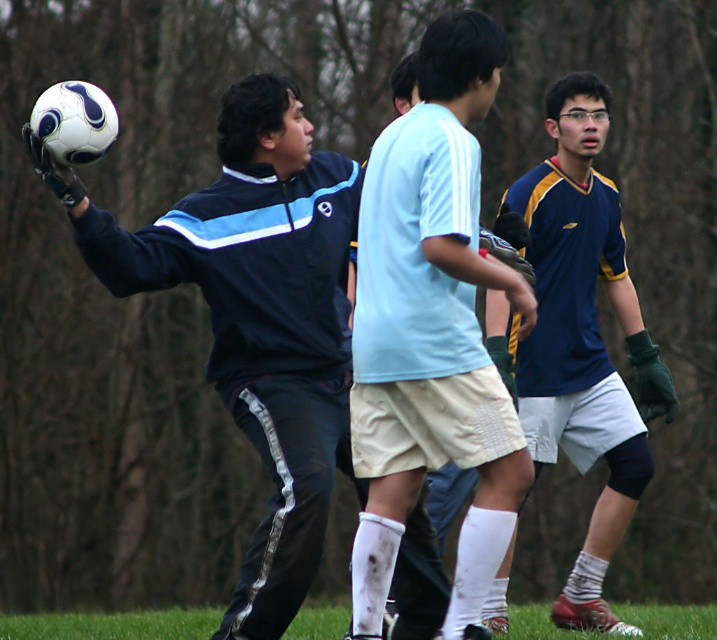
Question: Observing the image, what is the correct spatial positioning of light blue jersey at center in reference to blue jersey at right?

Choices:
 (A) left
 (B) right

Answer: (A)

Question: Is light blue jersey at center closer to the viewer compared to blue jersey at right?

Choices:
 (A) yes
 (B) no

Answer: (A)

Question: Which of the following is the closest to the observer?

Choices:
 (A) (419, 355)
 (B) (607, 372)
 (C) (298, 179)
 (D) (24, 627)

Answer: (A)

Question: Does light blue jersey at center appear under blue jersey at right?

Choices:
 (A) yes
 (B) no

Answer: (B)

Question: Which point appears farthest from the camera in this image?

Choices:
 (A) (574, 102)
 (B) (505, 54)

Answer: (A)

Question: Based on their relative distances, which object is nearer to the blue jersey at right?

Choices:
 (A) matte black jacket at center
 (B) green grass at lower center

Answer: (A)